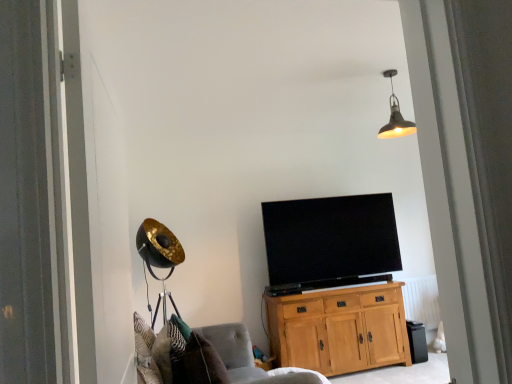
What is the approximate width of white painted radiator at lower right?

3.45 inches.

What do you see at coordinates (178, 348) in the screenshot?
I see `patterned fabric pillow at lower left` at bounding box center [178, 348].

The height and width of the screenshot is (384, 512). I want to click on patterned fabric pillow at lower left, so click(178, 348).

Describe the element at coordinates (250, 358) in the screenshot. I see `soft gray fabric chair at lower left` at that location.

Describe the element at coordinates (330, 242) in the screenshot. The image size is (512, 384). I see `black glossy tv at center` at that location.

This screenshot has width=512, height=384. Describe the element at coordinates (395, 115) in the screenshot. I see `metallic pendant light at upper center` at that location.

Identify the location of white painted radiator at lower right. (422, 300).

Could you tell me if patterned fabric pillow at lower left is turned towards metallic pendant light at upper center?

No, patterned fabric pillow at lower left is not turned towards metallic pendant light at upper center.

Can you confirm if patterned fabric pillow at lower left is thinner than metallic pendant light at upper center?

Yes, patterned fabric pillow at lower left is thinner than metallic pendant light at upper center.

Between patterned fabric pillow at lower left and metallic pendant light at upper center, which one is positioned behind?

metallic pendant light at upper center is behind.

Looking at this image, from the image's perspective, who appears lower, patterned fabric pillow at lower left or metallic pendant light at upper center?

patterned fabric pillow at lower left appears lower in the image.

Is black plastic trash bin at lower right situated inside metallic pendant light at upper center or outside?

black plastic trash bin at lower right is not inside metallic pendant light at upper center, it's outside.

Considering the positions of objects black plastic trash bin at lower right and metallic pendant light at upper center in the image provided, who is more to the left, black plastic trash bin at lower right or metallic pendant light at upper center?

metallic pendant light at upper center.

This screenshot has height=384, width=512. Identify the location of trash bin/can below the metallic pendant light at upper center (from a real-world perspective). (417, 341).

From the image's perspective, would you say black plastic trash bin at lower right is shown under metallic pendant light at upper center?

Indeed, from the image's perspective, black plastic trash bin at lower right is shown beneath metallic pendant light at upper center.

Looking at the image, does metallic pendant light at upper center seem bigger or smaller compared to light oak cabinet at center?

Considering their sizes, metallic pendant light at upper center takes up less space than light oak cabinet at center.

From a real-world perspective, which object stands above the other?

metallic pendant light at upper center.

Which is more distant, (383,74) or (358,327)?

Positioned behind is point (358,327).

Considering the positions of objects metallic pendant light at upper center and light oak cabinet at center in the image provided, who is behind, metallic pendant light at upper center or light oak cabinet at center?

Positioned behind is light oak cabinet at center.

Which object is closer to the camera, black glossy tv at center or white painted radiator at lower right?

Positioned in front is black glossy tv at center.

In the scene shown: From a real-world perspective, between black glossy tv at center and white painted radiator at lower right, who is vertically higher?

In real-world perspective, black glossy tv at center is above.

Does black glossy tv at center have a greater height compared to white painted radiator at lower right?

Yes.

Which is more to the left, black glossy tv at center or white painted radiator at lower right?

From the viewer's perspective, black glossy tv at center appears more on the left side.

From the image's perspective, would you say black plastic trash bin at lower right is positioned over soft gray fabric chair at lower left?

No, from the image's perspective, black plastic trash bin at lower right is not on top of soft gray fabric chair at lower left.

Does point (423, 339) come farther from viewer compared to point (303, 379)?

Yes, it is behind point (303, 379).

Based on the photo, is black plastic trash bin at lower right positioned behind soft gray fabric chair at lower left?

That is True.

What's the angular difference between black plastic trash bin at lower right and soft gray fabric chair at lower left's facing directions?

black plastic trash bin at lower right and soft gray fabric chair at lower left are facing 90.1 degrees away from each other.

Are patterned fabric pillow at lower left and white painted radiator at lower right making contact?

No, patterned fabric pillow at lower left is not beside white painted radiator at lower right.

Is patterned fabric pillow at lower left at the right side of white painted radiator at lower right?

In fact, patterned fabric pillow at lower left is to the left of white painted radiator at lower right.

Locate an element on the screen. The image size is (512, 384). pillow to the left of white painted radiator at lower right is located at coordinates (178, 348).

From the image's perspective, which one is positioned lower, patterned fabric pillow at lower left or white painted radiator at lower right?

From the image's view, white painted radiator at lower right is below.

Looking at this image, from a real-world perspective, who is located higher, light oak cabinet at center or patterned fabric pillow at lower left?

patterned fabric pillow at lower left, from a real-world perspective.

Relative to patterned fabric pillow at lower left, is light oak cabinet at center in front or behind?

Clearly, light oak cabinet at center is behind patterned fabric pillow at lower left.

Is light oak cabinet at center inside the boundaries of patterned fabric pillow at lower left, or outside?

The correct answer is: outside.

At what (x,y) coordinates should I click in order to perform the action: click on cabinetry below the patterned fabric pillow at lower left (from the image's perspective). Please return your answer as a coordinate pair (x, y). This screenshot has height=384, width=512. Looking at the image, I should click on (339, 329).

I want to click on lamp located above the patterned fabric pillow at lower left (from the image's perspective), so click(x=395, y=115).

You are a GUI agent. You are given a task and a screenshot of the screen. Output one action in this format:
    pyautogui.click(x=<x>, y=<y>)
    Task: Click on the lamp that is above the black plastic trash bin at lower right (from a real-world perspective)
    This screenshot has width=512, height=384.
    Given the screenshot: What is the action you would take?
    pyautogui.click(x=395, y=115)

Considering their positions, is white painted radiator at lower right positioned closer to light oak cabinet at center than patterned fabric pillow at lower left?

white painted radiator at lower right.

Looking at the image, which one is located further to metallic pendant light at upper center, black glossy tv at center or light oak cabinet at center?

light oak cabinet at center is further to metallic pendant light at upper center.

From the image, which object appears to be farther from white painted radiator at lower right, metallic pendant light at upper center or patterned fabric pillow at lower left?

Based on the image, patterned fabric pillow at lower left appears to be further to white painted radiator at lower right.

Based on their spatial positions, is black glossy tv at center or soft gray fabric chair at lower left closer to metallic pendant light at upper center?

The object closer to metallic pendant light at upper center is black glossy tv at center.

Estimate the real-world distances between objects in this image. Which object is further from light oak cabinet at center, soft gray fabric chair at lower left or patterned fabric pillow at lower left?

patterned fabric pillow at lower left lies further to light oak cabinet at center than the other object.

From the image, which object appears to be nearer to light oak cabinet at center, black glossy tv at center or black plastic trash bin at lower right?

Among the two, black glossy tv at center is located nearer to light oak cabinet at center.

Looking at this image, when comparing their distances from white painted radiator at lower right, does black glossy tv at center or black plastic trash bin at lower right seem closer?

black plastic trash bin at lower right is closer to white painted radiator at lower right.

From the image, which object appears to be farther from metallic pendant light at upper center, soft gray fabric chair at lower left or patterned fabric pillow at lower left?

Based on the image, patterned fabric pillow at lower left appears to be further to metallic pendant light at upper center.

You are a GUI agent. You are given a task and a screenshot of the screen. Output one action in this format:
    pyautogui.click(x=<x>, y=<y>)
    Task: Click on the cabinetry situated between patterned fabric pillow at lower left and black plastic trash bin at lower right from left to right
    This screenshot has width=512, height=384.
    Given the screenshot: What is the action you would take?
    pyautogui.click(x=339, y=329)

You are a GUI agent. You are given a task and a screenshot of the screen. Output one action in this format:
    pyautogui.click(x=<x>, y=<y>)
    Task: Click on the pillow between soft gray fabric chair at lower left and white painted radiator at lower right along the z-axis
    Image resolution: width=512 pixels, height=384 pixels.
    Given the screenshot: What is the action you would take?
    178,348

Image resolution: width=512 pixels, height=384 pixels. I want to click on trash bin/can between black glossy tv at center and white painted radiator at lower right from left to right, so click(x=417, y=341).

You are a GUI agent. You are given a task and a screenshot of the screen. Output one action in this format:
    pyautogui.click(x=<x>, y=<y>)
    Task: Click on the radiator between metallic pendant light at upper center and black plastic trash bin at lower right from top to bottom
    The width and height of the screenshot is (512, 384).
    Given the screenshot: What is the action you would take?
    pyautogui.click(x=422, y=300)